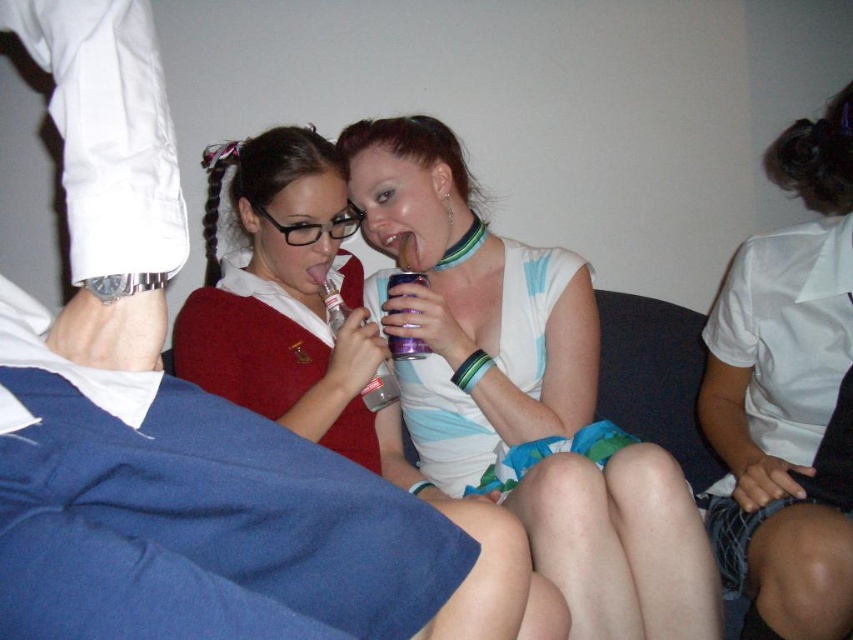
You are a fashion designer observing the two white garments in the scene. The white matte shirt at upper right and the matte white dress at center. Which garment has a smaller width?

The white matte shirt at upper right has a lesser width compared to the matte white dress at center, so the white matte shirt at upper right is smaller in width.

Consider the image. You are a photographer setting up a shot of the two people on the couch. You need to ensure that the white matte shirt at upper right and the purple metallic can at center are both visible in the frame. Based on their sizes, which object should you prioritize keeping in focus to ensure it doesn

The white matte shirt at upper right should be prioritized in focus because it has a greater height compared to the purple metallic can at center, making it more prominent in the scene.